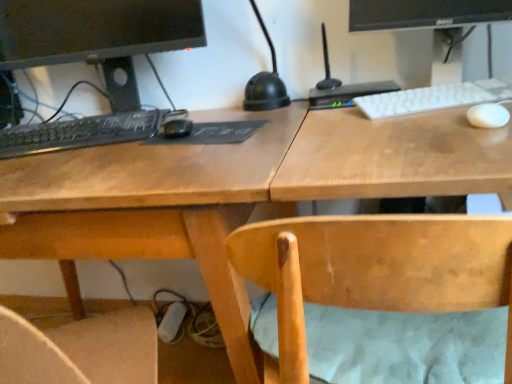
Identify the location of free spot to the right of black matte keyboard at left, positioned as the first computer keyboard in left-to-right order. This screenshot has width=512, height=384. (176, 134).